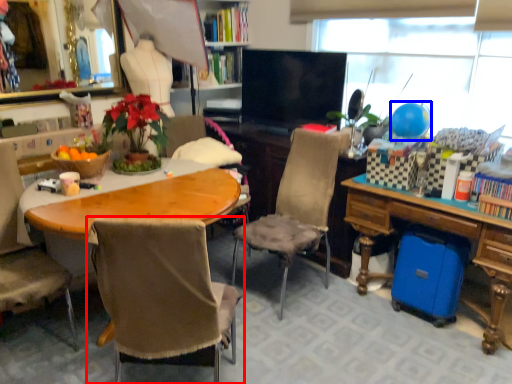
Question: Which object is closer to the camera taking this photo, chair (highlighted by a red box) or balloon (highlighted by a blue box)?

Choices:
 (A) chair
 (B) balloon

Answer: (A)